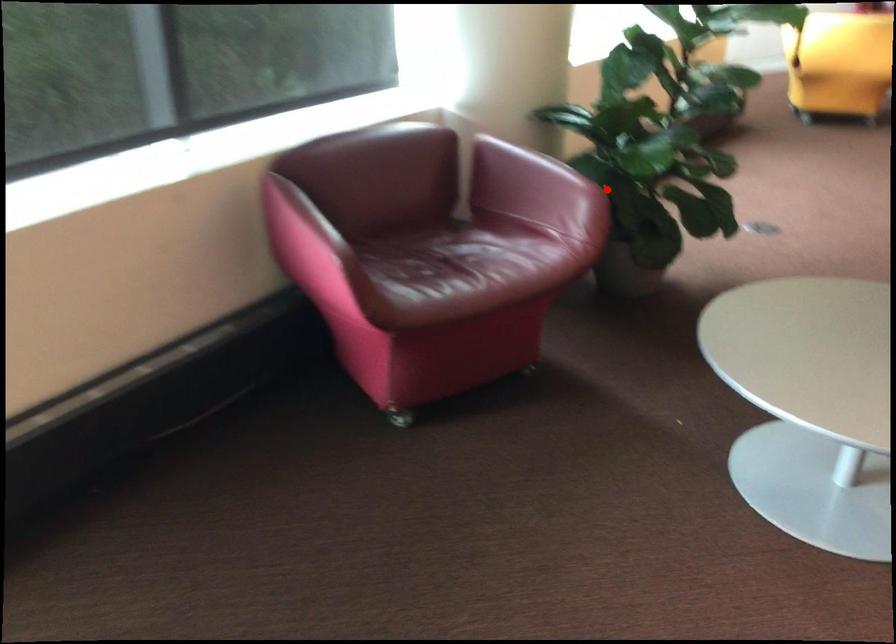
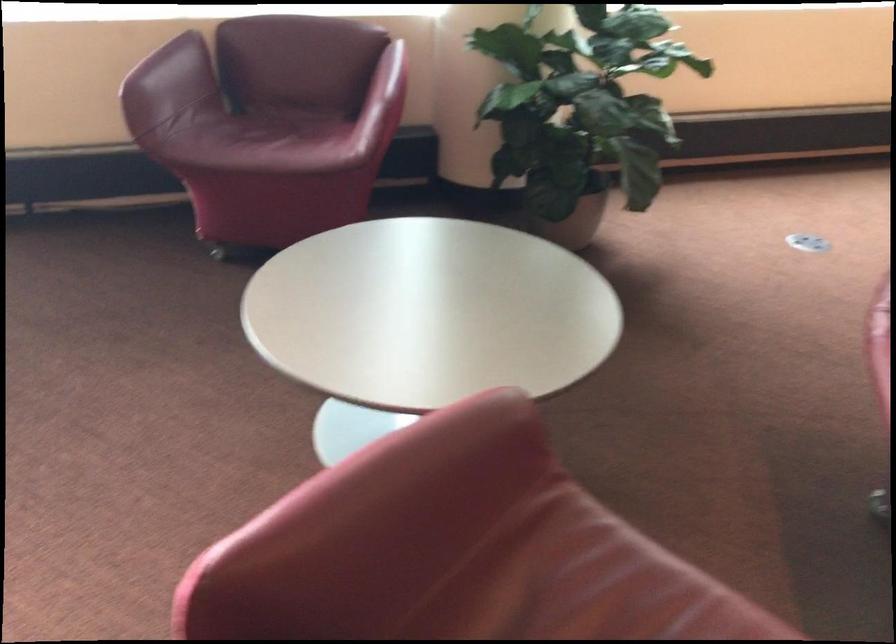
Where in the second image is the point corresponding to the highlighted location from the first image?

(385, 100)